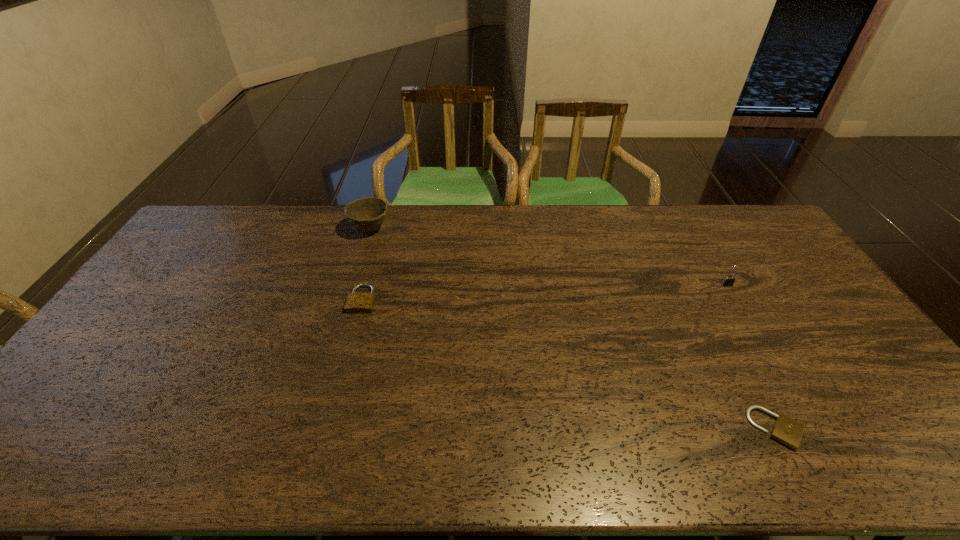
Identify which object is the closest to the second shortest padlock. Please provide its 2D coordinates. Your answer should be formatted as a tuple, i.e. [(x, y)], where the tuple contains the x and y coordinates of a point satisfying the conditions above.

[(367, 214)]

Identify which padlock is the closest to the rightmost padlock. Please provide its 2D coordinates. Your answer should be formatted as a tuple, i.e. [(x, y)], where the tuple contains the x and y coordinates of a point satisfying the conditions above.

[(787, 431)]

The width and height of the screenshot is (960, 540). I want to click on padlock object that ranks as the closest to the second shortest padlock, so click(787, 431).

The width and height of the screenshot is (960, 540). Find the location of `vacant space that satisfies the following two spatial constraints: 1. on the keyhole side of the third tallest object; 2. on the left side of the second padlock from left to right`. vacant space that satisfies the following two spatial constraints: 1. on the keyhole side of the third tallest object; 2. on the left side of the second padlock from left to right is located at coordinates (327, 429).

Identify the location of vacant region that satisfies the following two spatial constraints: 1. on the keyhole side of the third object from left to right; 2. on the left side of the second shortest object. (327, 429).

Locate an element on the screen. free space that satisfies the following two spatial constraints: 1. on the front side of the farthest object; 2. on the left side of the third object from left to right is located at coordinates (310, 429).

I want to click on vacant position in the image that satisfies the following two spatial constraints: 1. on the keyhole side of the second object from right to left; 2. on the right side of the leftmost padlock, so click(327, 429).